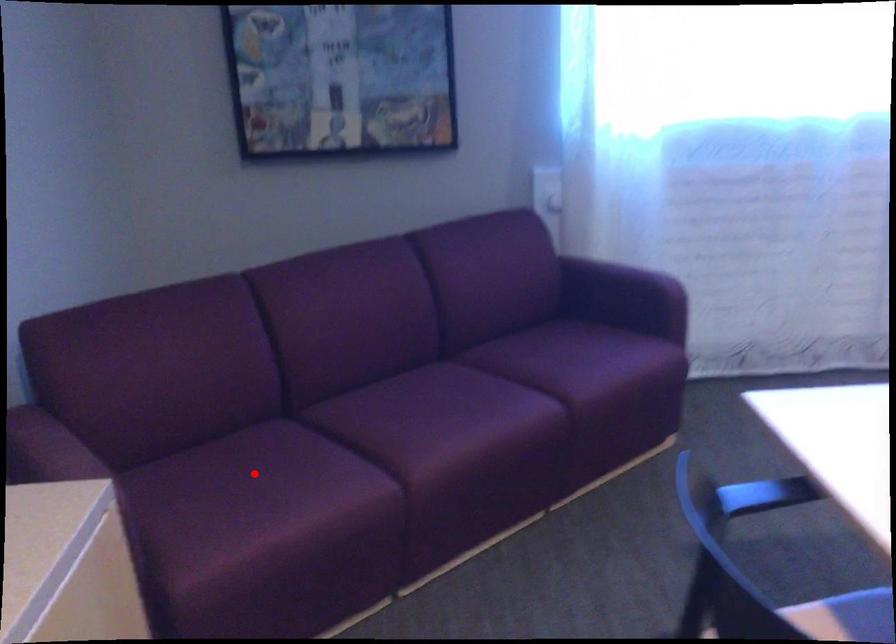
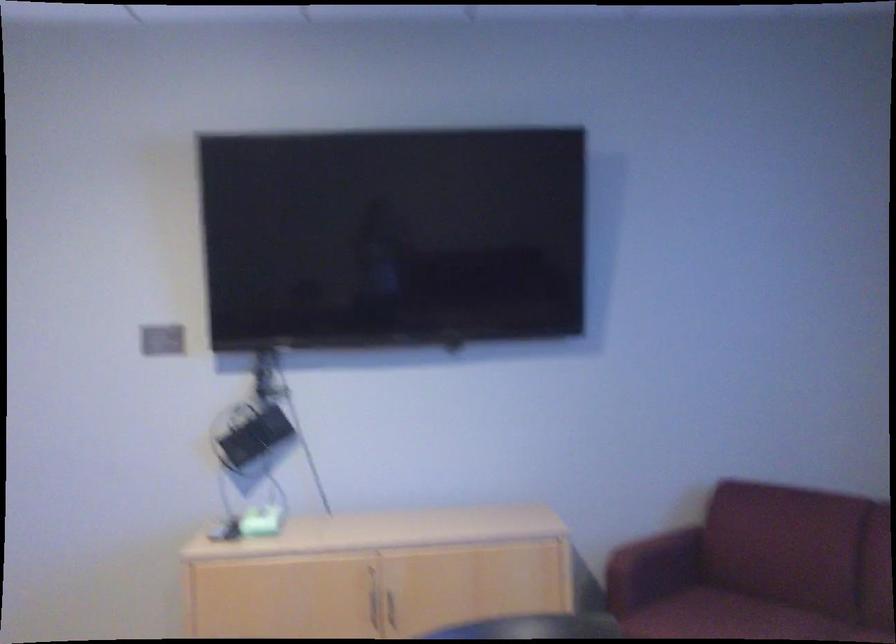
Question: I am providing you with two images of the same scene from different viewpoints. Image1 has a red point marked. In image2, the corresponding 3D location appears at what relative position? Reply with the corresponding letter.

Choices:
 (A) Closer
 (B) Farther

Answer: (B)